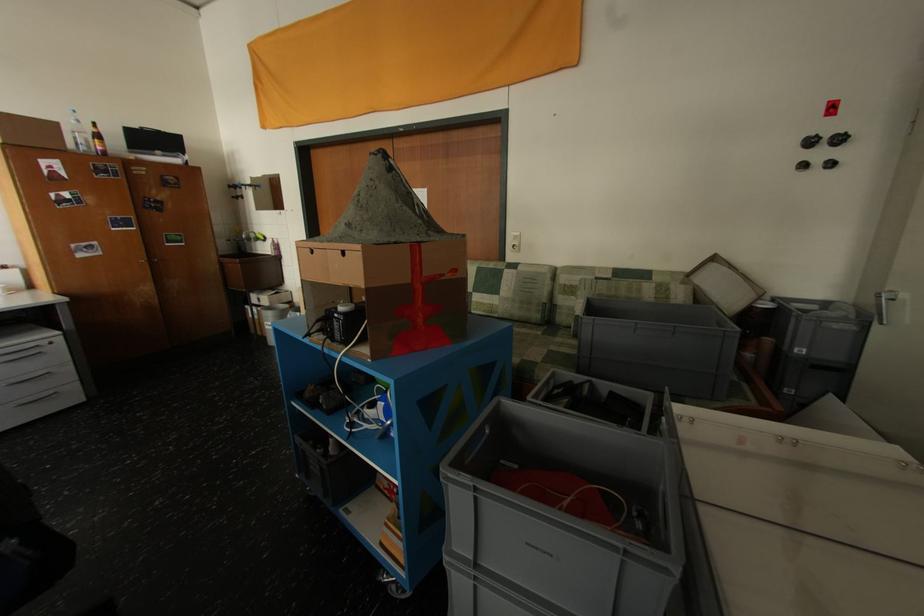
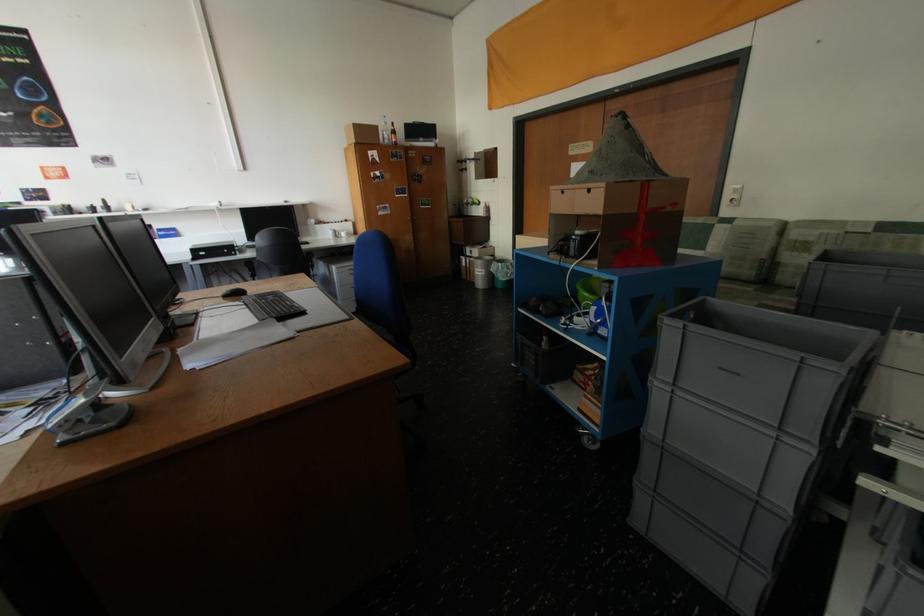
Where in the second image is the point corresponding to point 536,545 from the first image?

(728, 370)